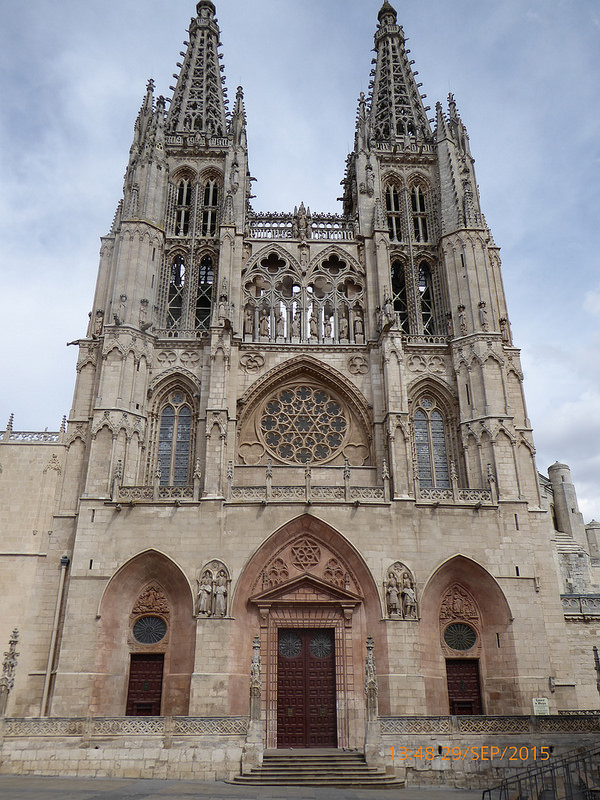
I want to click on staircase, so click(562, 790), click(316, 773).